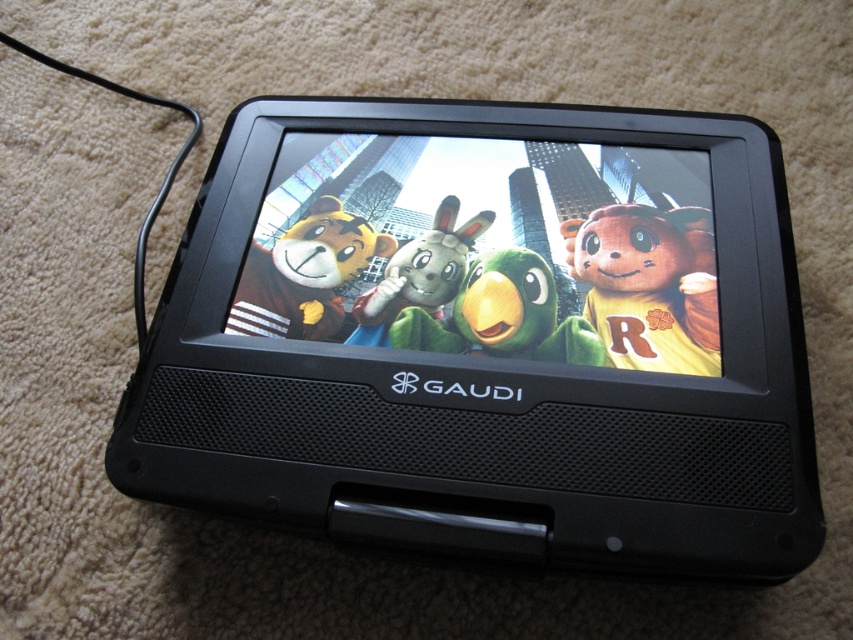
Is the position of matte plastic screen at center less distant than that of yellow fabric bear at center?

That is False.

Is point (601, 301) positioned behind point (635, 205)?

No, it is not.

What do you see at coordinates (489, 252) in the screenshot? I see `matte plastic screen at center` at bounding box center [489, 252].

The height and width of the screenshot is (640, 853). What are the coordinates of `matte plastic screen at center` in the screenshot? It's located at (489, 252).

Does black plastic portable dvd player at center appear on the left side of yellow fabric bear at center?

Indeed, black plastic portable dvd player at center is positioned on the left side of yellow fabric bear at center.

Which is behind, point (325, 154) or point (698, 300)?

The point (325, 154) is more distant.

Between point (247, 211) and point (598, 288), which one is positioned behind?

The point (247, 211) is behind.

Where is `black plastic portable dvd player at center`? black plastic portable dvd player at center is located at coordinates (488, 337).

Does black plastic portable dvd player at center lie behind matte plastic screen at center?

That is False.

From the picture: Does black plastic portable dvd player at center have a smaller size compared to matte plastic screen at center?

No.

Does point (575, 218) lie behind point (697, 310)?

Yes, it is.

Locate an element on the screen. black plastic portable dvd player at center is located at coordinates (488, 337).